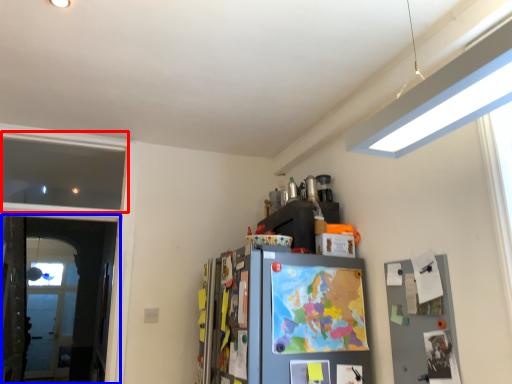
Question: Among these objects, which one is nearest to the camera, window (highlighted by a red box) or screen door (highlighted by a blue box)?

Choices:
 (A) window
 (B) screen door

Answer: (B)